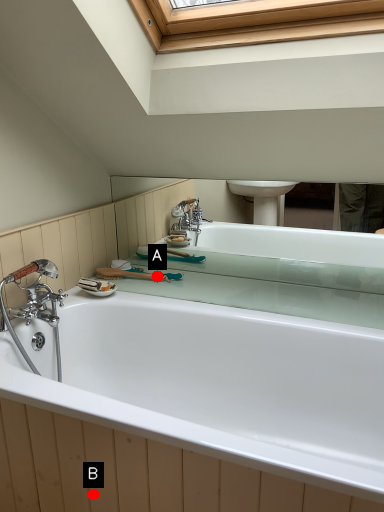
Question: Two points are circled on the image, labeled by A and B beside each circle. Which point is further to the camera?

Choices:
 (A) A is further
 (B) B is further

Answer: (A)